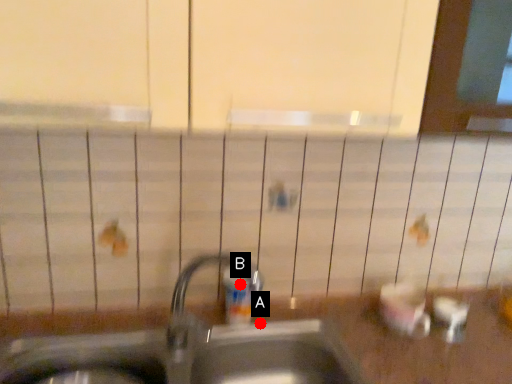
Question: Two points are circled on the image, labeled by A and B beside each circle. Which point appears closest to the camera in this image?

Choices:
 (A) A is closer
 (B) B is closer

Answer: (B)